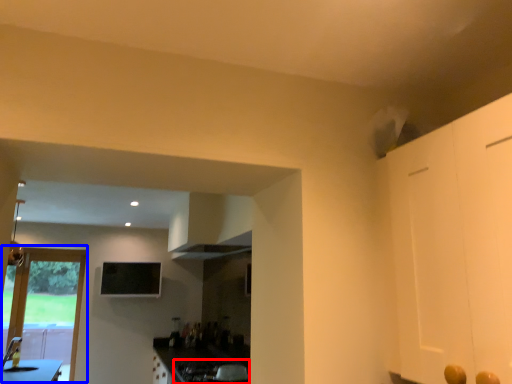
Question: Which point is closer to the camera, gas stove (highlighted by a red box) or door (highlighted by a blue box)?

Choices:
 (A) gas stove
 (B) door

Answer: (A)